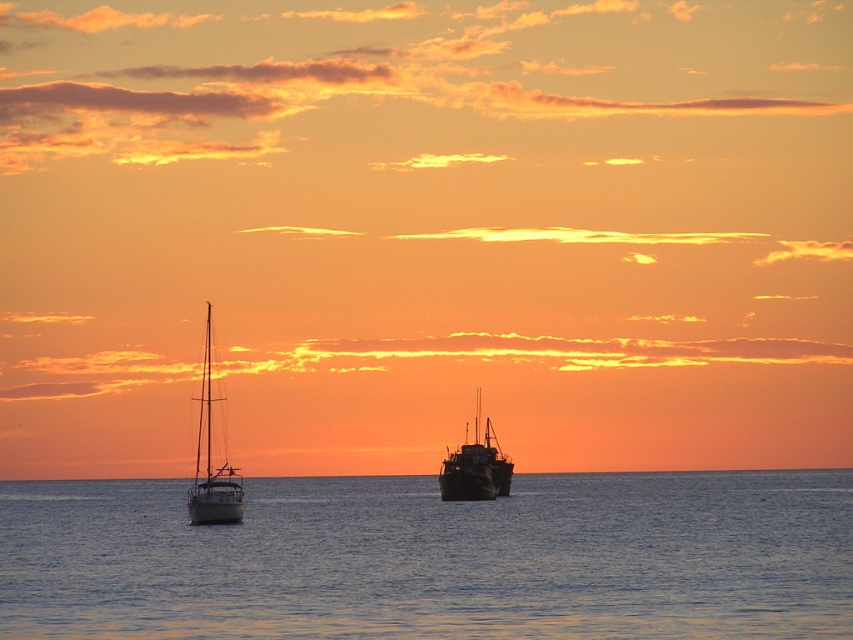
Is clear blue water at center thinner than rusty metal boat at center?

No, clear blue water at center is not thinner than rusty metal boat at center.

What are the coordinates of `clear blue water at center` in the screenshot? It's located at (434, 557).

Which is more to the left, clear blue water at center or shiny white sailboat at left?

Positioned to the left is shiny white sailboat at left.

Who is taller, clear blue water at center or shiny white sailboat at left?

With more height is shiny white sailboat at left.

Does point (593, 548) come in front of point (199, 403)?

That is True.

In order to click on clear blue water at center in this screenshot , I will do `click(434, 557)`.

Can you confirm if shiny white sailboat at left is positioned to the right of rusty metal boat at center?

No, shiny white sailboat at left is not to the right of rusty metal boat at center.

This screenshot has width=853, height=640. What do you see at coordinates (212, 454) in the screenshot?
I see `shiny white sailboat at left` at bounding box center [212, 454].

Who is more forward, (196, 449) or (486, 497)?

Point (486, 497) is more forward.

Find the location of a particular element. shiny white sailboat at left is located at coordinates (212, 454).